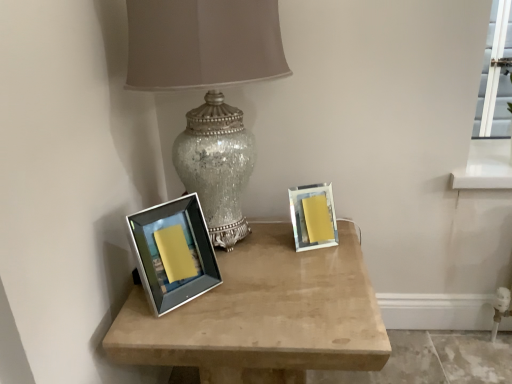
This screenshot has height=384, width=512. Identify the location of vacant space to the right of silver/metallic picture frame at left, the first picture frame viewed from the front. (248, 284).